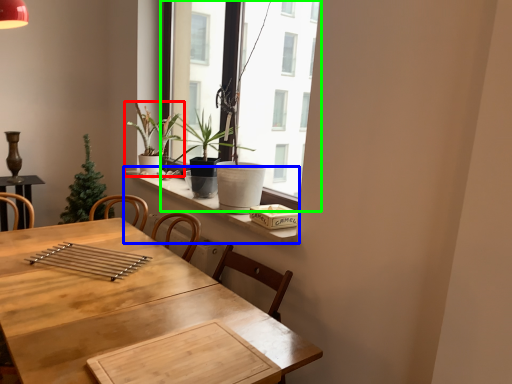
Question: Which object is positioned farthest from houseplant (highlighted by a red box)? Select from window sill (highlighted by a blue box) and window (highlighted by a green box).

Choices:
 (A) window sill
 (B) window

Answer: (B)